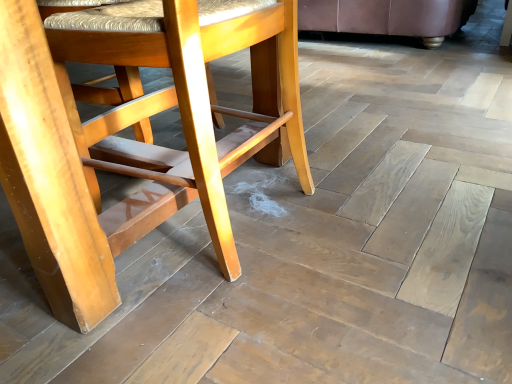
This screenshot has width=512, height=384. I want to click on wooden chair at upper right, the first chair positioned from the back, so click(386, 17).

What do you see at coordinates (386, 17) in the screenshot? I see `wooden chair at upper right, the first chair positioned from the back` at bounding box center [386, 17].

The image size is (512, 384). Describe the element at coordinates (133, 140) in the screenshot. I see `light brown wood chair at center, the first chair from the bottom` at that location.

How much space does light brown wood chair at center, which ranks as the second chair in top-to-bottom order, occupy vertically?

light brown wood chair at center, which ranks as the second chair in top-to-bottom order, is 19.78 inches tall.

At what (x,y) coordinates should I click in order to perform the action: click on light brown wood chair at center, which ranks as the second chair in top-to-bottom order. Please return your answer as a coordinate pair (x, y). Looking at the image, I should click on (133, 140).

Image resolution: width=512 pixels, height=384 pixels. In order to click on wooden chair at upper right, the first chair positioned from the back in this screenshot , I will do `click(386, 17)`.

Visually, is light brown wood chair at center, the first chair from the bottom, positioned to the left or to the right of wooden chair at upper right, which appears as the 2th chair when viewed from the front?

From the image, it's evident that light brown wood chair at center, the first chair from the bottom, is to the left of wooden chair at upper right, which appears as the 2th chair when viewed from the front.

Between light brown wood chair at center, which is counted as the second chair, starting from the back, and wooden chair at upper right, which appears as the 2th chair when viewed from the front, which one is positioned behind?

wooden chair at upper right, which appears as the 2th chair when viewed from the front.

Considering the positions of point (211, 113) and point (368, 17), is point (211, 113) closer or farther from the camera than point (368, 17)?

Point (211, 113).

From the image's perspective, is light brown wood chair at center, which ranks as the second chair in top-to-bottom order, above wooden chair at upper right, the first chair positioned from the back?

No, from the image's perspective, light brown wood chair at center, which ranks as the second chair in top-to-bottom order, is not over wooden chair at upper right, the first chair positioned from the back.

From a real-world perspective, is light brown wood chair at center, the first chair from the bottom, beneath wooden chair at upper right, the first chair positioned from the back?

No, from a real-world perspective, light brown wood chair at center, the first chair from the bottom, is not beneath wooden chair at upper right, the first chair positioned from the back.

Is light brown wood chair at center, which ranks as the 1th chair in front-to-back order, wider than wooden chair at upper right, the first chair positioned from the back?

No, light brown wood chair at center, which ranks as the 1th chair in front-to-back order, is not wider than wooden chair at upper right, the first chair positioned from the back.

Considering the relative sizes of light brown wood chair at center, which ranks as the 1th chair in front-to-back order, and wooden chair at upper right, which appears as the 2th chair when viewed from the front, in the image provided, is light brown wood chair at center, which ranks as the 1th chair in front-to-back order, shorter than wooden chair at upper right, which appears as the 2th chair when viewed from the front,?

Incorrect, the height of light brown wood chair at center, which ranks as the 1th chair in front-to-back order, does not fall short of that of wooden chair at upper right, which appears as the 2th chair when viewed from the front.

In terms of size, does light brown wood chair at center, which ranks as the second chair in top-to-bottom order, appear bigger or smaller than wooden chair at upper right, acting as the 1th chair starting from the top?

light brown wood chair at center, which ranks as the second chair in top-to-bottom order, is smaller than wooden chair at upper right, acting as the 1th chair starting from the top.

Choose the correct answer: Is light brown wood chair at center, which ranks as the 1th chair in front-to-back order, inside wooden chair at upper right, acting as the 1th chair starting from the top, or outside it?

light brown wood chair at center, which ranks as the 1th chair in front-to-back order, exists outside the volume of wooden chair at upper right, acting as the 1th chair starting from the top.

Are light brown wood chair at center, which ranks as the second chair in top-to-bottom order, and wooden chair at upper right, which appears as the 2th chair when viewed from the front, beside each other?

No, light brown wood chair at center, which ranks as the second chair in top-to-bottom order, is not next to wooden chair at upper right, which appears as the 2th chair when viewed from the front.

Based on the photo, is light brown wood chair at center, the first chair from the bottom, oriented towards wooden chair at upper right, positioned as the second chair in bottom-to-top order?

No, light brown wood chair at center, the first chair from the bottom, does not turn towards wooden chair at upper right, positioned as the second chair in bottom-to-top order.

Measure the distance from light brown wood chair at center, the first chair from the bottom, to wooden chair at upper right, which appears as the 2th chair when viewed from the front.

They are 1.83 meters apart.

At what (x,y) coordinates should I click in order to perform the action: click on chair in front of the wooden chair at upper right, the first chair positioned from the back. Please return your answer as a coordinate pair (x, y). Looking at the image, I should click on (133, 140).

Can you confirm if wooden chair at upper right, the first chair positioned from the back, is positioned to the right of light brown wood chair at center, which ranks as the second chair in top-to-bottom order?

Yes.

Who is more distant, wooden chair at upper right, which appears as the 2th chair when viewed from the front, or light brown wood chair at center, the first chair from the bottom?

wooden chair at upper right, which appears as the 2th chair when viewed from the front, is behind.

Between point (370, 6) and point (78, 58), which one is positioned in front?

The point (78, 58) is in front.

From the image's perspective, would you say wooden chair at upper right, which appears as the 2th chair when viewed from the front, is shown under light brown wood chair at center, which is counted as the second chair, starting from the back?

No, from the image's perspective, wooden chair at upper right, which appears as the 2th chair when viewed from the front, is not beneath light brown wood chair at center, which is counted as the second chair, starting from the back.

From a real-world perspective, which object stands above the other?

light brown wood chair at center, which is counted as the second chair, starting from the back, from a real-world perspective.

Which object is wider, wooden chair at upper right, acting as the 1th chair starting from the top, or light brown wood chair at center, which ranks as the second chair in top-to-bottom order?

Answer: With larger width is wooden chair at upper right, acting as the 1th chair starting from the top.

In terms of height, does wooden chair at upper right, which appears as the 2th chair when viewed from the front, look taller or shorter compared to light brown wood chair at center, the first chair from the bottom?

In the image, wooden chair at upper right, which appears as the 2th chair when viewed from the front, appears to be shorter than light brown wood chair at center, the first chair from the bottom.

Is wooden chair at upper right, which appears as the 2th chair when viewed from the front, bigger than light brown wood chair at center, the first chair from the bottom?

Yes, wooden chair at upper right, which appears as the 2th chair when viewed from the front, is bigger than light brown wood chair at center, the first chair from the bottom.

Is wooden chair at upper right, which appears as the 2th chair when viewed from the front, inside the boundaries of light brown wood chair at center, which ranks as the second chair in top-to-bottom order, or outside?

wooden chair at upper right, which appears as the 2th chair when viewed from the front, exists outside the volume of light brown wood chair at center, which ranks as the second chair in top-to-bottom order.

Would you consider wooden chair at upper right, acting as the 1th chair starting from the top, to be distant from light brown wood chair at center, which ranks as the second chair in top-to-bottom order?

Indeed, wooden chair at upper right, acting as the 1th chair starting from the top, is not near light brown wood chair at center, which ranks as the second chair in top-to-bottom order.

Could you tell me if wooden chair at upper right, positioned as the second chair in bottom-to-top order, is turned towards light brown wood chair at center, which is counted as the second chair, starting from the back?

No, wooden chair at upper right, positioned as the second chair in bottom-to-top order, is not turned towards light brown wood chair at center, which is counted as the second chair, starting from the back.

Can you tell me how much wooden chair at upper right, acting as the 1th chair starting from the top, and light brown wood chair at center, which ranks as the second chair in top-to-bottom order, differ in facing direction?

There is a 90.9-degree angle between the facing directions of wooden chair at upper right, acting as the 1th chair starting from the top, and light brown wood chair at center, which ranks as the second chair in top-to-bottom order.

You are a GUI agent. You are given a task and a screenshot of the screen. Output one action in this format:
    pyautogui.click(x=<x>, y=<y>)
    Task: Click on the chair in front of the wooden chair at upper right, the first chair positioned from the back
    The width and height of the screenshot is (512, 384).
    Given the screenshot: What is the action you would take?
    pyautogui.click(x=133, y=140)

I want to click on chair that appears above the light brown wood chair at center, which is counted as the second chair, starting from the back (from the image's perspective), so click(x=386, y=17).

The height and width of the screenshot is (384, 512). Find the location of `chair below the wooden chair at upper right, acting as the 1th chair starting from the top (from the image's perspective)`. chair below the wooden chair at upper right, acting as the 1th chair starting from the top (from the image's perspective) is located at coordinates (133, 140).